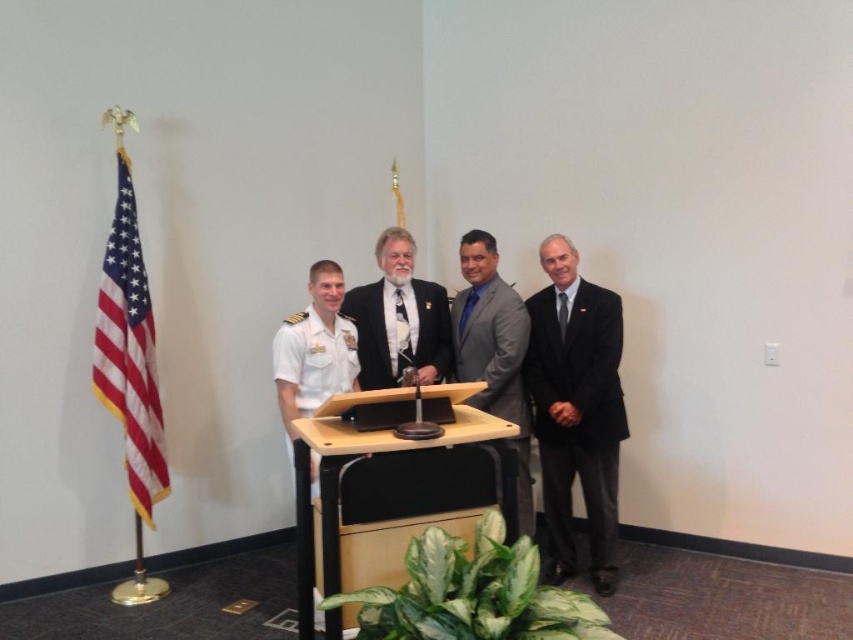
Question: Does black satin business suit at right lie in front of american flag at left?

Choices:
 (A) no
 (B) yes

Answer: (A)

Question: Does american flag at left appear under matte black suit at center?

Choices:
 (A) yes
 (B) no

Answer: (A)

Question: Is american flag at left wider than matte black suit at center?

Choices:
 (A) no
 (B) yes

Answer: (A)

Question: Which of the following is the closest to the observer?

Choices:
 (A) (136, 323)
 (B) (379, 397)
 (C) (364, 300)
 (D) (599, 438)

Answer: (B)

Question: Among these points, which one is nearest to the camera?

Choices:
 (A) (312, 449)
 (B) (109, 330)
 (C) (369, 301)

Answer: (A)

Question: Estimate the real-world distances between objects in this image. Which object is farther from the gray matte suit at center?

Choices:
 (A) matte black suit at center
 (B) light brown wood podium at center
 (C) american flag at left
 (D) black satin business suit at right

Answer: (C)